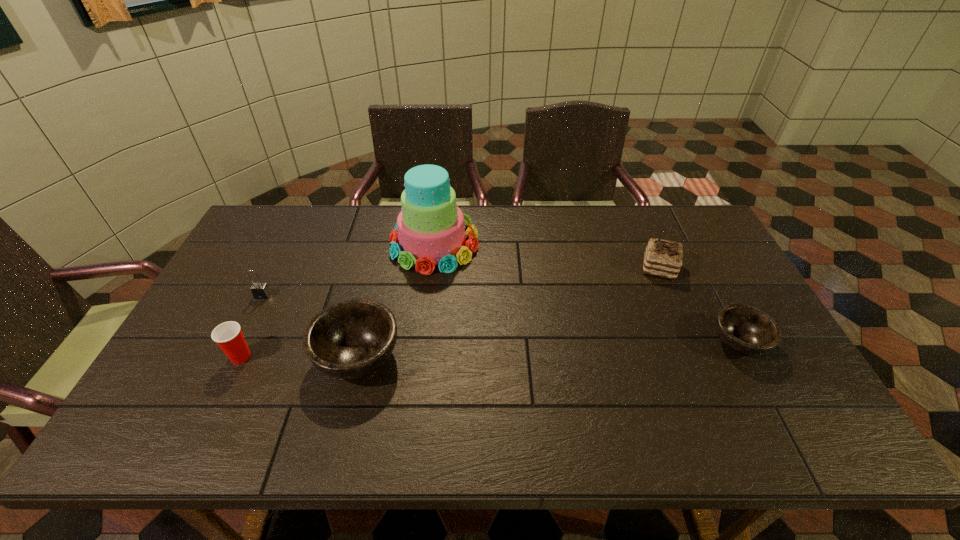
Locate an element on the screen. vacant spot for a new bowl to ensure equal spacing is located at coordinates (551, 349).